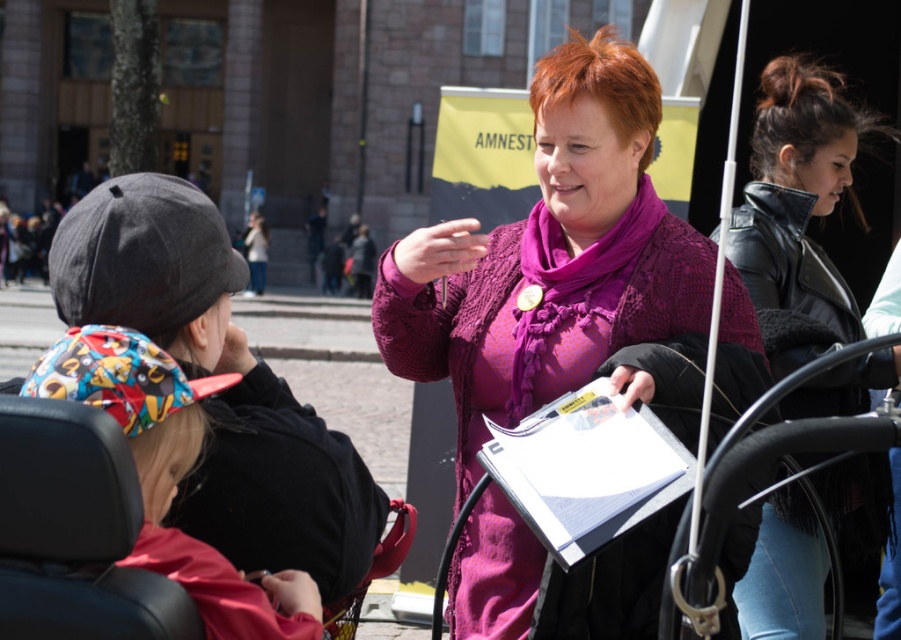
Between leather jacket at right and white paper clipboard at center, which one is positioned lower?

leather jacket at right is below.

Between leather jacket at right and white paper clipboard at center, which one has more height?

With more height is white paper clipboard at center.

Is point (824, 150) positioned in front of point (563, 566)?

No, (824, 150) is further to viewer.

You are a GUI agent. You are given a task and a screenshot of the screen. Output one action in this format:
    pyautogui.click(x=<x>, y=<y>)
    Task: Click on the leather jacket at right
    
    Given the screenshot: What is the action you would take?
    pyautogui.click(x=798, y=193)

Does purple lace cardigan at center have a greater width compared to white paper clipboard at center?

No, purple lace cardigan at center is not wider than white paper clipboard at center.

Is the position of purple lace cardigan at center less distant than that of white paper clipboard at center?

No, purple lace cardigan at center is further to the viewer.

Which is behind, point (510, 392) or point (611, 404)?

Positioned behind is point (510, 392).

Where is `purple lace cardigan at center`? purple lace cardigan at center is located at coordinates (551, 257).

Is purple lace cardigan at center bigger than leather jacket at right?

Incorrect, purple lace cardigan at center is not larger than leather jacket at right.

Who is more forward, (429, 346) or (780, 260)?

Positioned in front is point (429, 346).

What are the coordinates of `purple lace cardigan at center` in the screenshot? It's located at (551, 257).